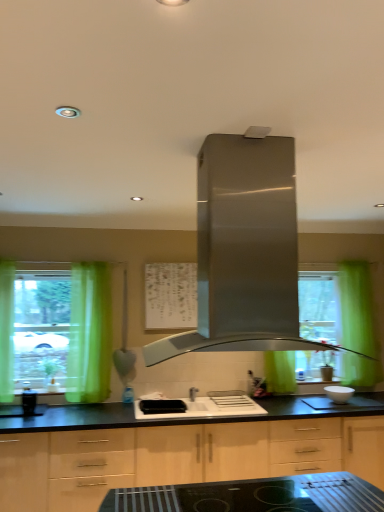
What is the approximate height of light wood cabinet at center?

36.89 inches.

What do you see at coordinates (41, 329) in the screenshot? The height and width of the screenshot is (512, 384). I see `transparent glass window at left` at bounding box center [41, 329].

What is the approximate width of black glossy coffee maker at left?

The width of black glossy coffee maker at left is 5.01 inches.

The height and width of the screenshot is (512, 384). Describe the element at coordinates (28, 402) in the screenshot. I see `black glossy coffee maker at left` at that location.

Find the location of a particular element. This screenshot has width=384, height=512. stainless steel range hood at center is located at coordinates (245, 252).

Find the location of `light wood cabinet at center`. light wood cabinet at center is located at coordinates pos(179,458).

From the image's perspective, which object appears higher, white matte bowl at lower right or green fabric curtain at left?

green fabric curtain at left.

Can you confirm if white matte bowl at lower right is bigger than green fabric curtain at left?

Actually, white matte bowl at lower right might be smaller than green fabric curtain at left.

Would you say white matte bowl at lower right is to the left or to the right of green fabric curtain at left in the picture?

From the image, it's evident that white matte bowl at lower right is to the right of green fabric curtain at left.

Measure the distance from white matte bowl at lower right to green fabric curtain at left.

2.06 meters.

Who is shorter, green fabric curtain at left or white glossy sink at center?

white glossy sink at center.

Can you confirm if green fabric curtain at left is positioned to the left of white glossy sink at center?

Yes.

Looking at this image, who is smaller, green fabric curtain at left or white glossy sink at center?

white glossy sink at center is smaller.

Is green fabric curtain at left positioned behind white glossy sink at center?

Yes, green fabric curtain at left is further from the camera.

How distant is white glossy sink at center from black glossy coffee maker at left?

white glossy sink at center and black glossy coffee maker at left are 1.24 meters apart from each other.

Is white glossy sink at center situated inside black glossy coffee maker at left or outside?

white glossy sink at center is not enclosed by black glossy coffee maker at left.

Which of these two, white glossy sink at center or black glossy coffee maker at left, stands taller?

Standing taller between the two is black glossy coffee maker at left.

Is transparent glass window at left oriented towards green fabric curtain at left?

No, transparent glass window at left is not facing towards green fabric curtain at left.

How different are the orientations of transparent glass window at left and green fabric curtain at left in degrees?

transparent glass window at left and green fabric curtain at left are facing 1.13 degrees away from each other.

Does point (54, 351) come farther from viewer compared to point (88, 386)?

Yes, it is.

Considering the relative positions of transparent glass window at left and green fabric curtain at left in the image provided, is transparent glass window at left to the right of green fabric curtain at left from the viewer's perspective?

No.

Is green fabric curtain at left far away from transparent glass window at left?

green fabric curtain at left is actually quite close to transparent glass window at left.

Is green fabric curtain at left outside of transparent glass window at left?

Yes, green fabric curtain at left is not within transparent glass window at left.

From the image's perspective, would you say green fabric curtain at left is shown under transparent glass window at left?

Indeed, from the image's perspective, green fabric curtain at left is shown beneath transparent glass window at left.

Is green fabric curtain at left positioned with its back to transparent glass window at left?

No, green fabric curtain at left is not facing the opposite direction of transparent glass window at left.

Which object is positioned more to the right, white glossy sink at center or light wood cabinet at center?

Positioned to the right is white glossy sink at center.

Is white glossy sink at center surrounding light wood cabinet at center?

That's incorrect, light wood cabinet at center is not inside white glossy sink at center.

From a real-world perspective, is white glossy sink at center over light wood cabinet at center?

Yes, from a real-world perspective, white glossy sink at center is above light wood cabinet at center.

Identify the location of cabinetry located in front of the white glossy sink at center. The height and width of the screenshot is (512, 384). (179, 458).

Considering the sizes of objects black glossy coffee maker at left and white glossy sink at center in the image provided, who is wider, black glossy coffee maker at left or white glossy sink at center?

white glossy sink at center is wider.

You are a GUI agent. You are given a task and a screenshot of the screen. Output one action in this format:
    pyautogui.click(x=<x>, y=<y>)
    Task: Click on the appliance behind the white glossy sink at center
    
    Given the screenshot: What is the action you would take?
    pyautogui.click(x=28, y=402)

From the image's perspective, would you say black glossy coffee maker at left is shown under white glossy sink at center?

No, from the image's perspective, black glossy coffee maker at left is not beneath white glossy sink at center.

Considering the sizes of objects black glossy coffee maker at left and white glossy sink at center in the image provided, who is smaller, black glossy coffee maker at left or white glossy sink at center?

black glossy coffee maker at left is smaller.

Locate an element on the screen. The image size is (384, 512). curtain above the white matte bowl at lower right (from a real-world perspective) is located at coordinates (89, 334).

Where is `sink on the right of the green fabric curtain at left`? sink on the right of the green fabric curtain at left is located at coordinates (199, 406).

Looking at this image, estimate the real-world distances between objects in this image. Which object is closer to white matte bowl at lower right, black glossy coffee maker at left or light wood cabinet at center?

light wood cabinet at center is positioned closer to the anchor white matte bowl at lower right.

Which object lies nearer to the anchor point stainless steel range hood at center, white glossy sink at center or transparent glass window at left?

white glossy sink at center.

Estimate the real-world distances between objects in this image. Which object is further from white glossy sink at center, black glossy coffee maker at left or stainless steel range hood at center?

stainless steel range hood at center lies further to white glossy sink at center than the other object.

Which object lies further to the anchor point black glossy coffee maker at left, light wood cabinet at center or white glossy sink at center?

light wood cabinet at center is further to black glossy coffee maker at left.

Which object lies nearer to the anchor point white matte bowl at lower right, stainless steel range hood at center or black glossy coffee maker at left?

Based on the image, stainless steel range hood at center appears to be nearer to white matte bowl at lower right.

Estimate the real-world distances between objects in this image. Which object is further from stainless steel range hood at center, white matte bowl at lower right or black glossy coffee maker at left?

Among the two, black glossy coffee maker at left is located further to stainless steel range hood at center.

Looking at the image, which one is located closer to green fabric curtain at left, transparent glass window at left or stainless steel range hood at center?

transparent glass window at left is closer to green fabric curtain at left.

From the image, which object appears to be nearer to green fabric curtain at left, white matte bowl at lower right or light wood cabinet at center?

light wood cabinet at center is closer to green fabric curtain at left.

Locate an element on the screen. This screenshot has width=384, height=512. cabinetry located between green fabric curtain at left and white matte bowl at lower right in the left-right direction is located at coordinates (179, 458).

Identify the location of sink between stainless steel range hood at center and green fabric curtain at left from front to back. This screenshot has height=512, width=384. (199, 406).

Locate an element on the screen. The height and width of the screenshot is (512, 384). cabinetry situated between black glossy coffee maker at left and white matte bowl at lower right from left to right is located at coordinates (179, 458).

Find the location of a particular element. sink located between stainless steel range hood at center and white matte bowl at lower right in the depth direction is located at coordinates (199, 406).